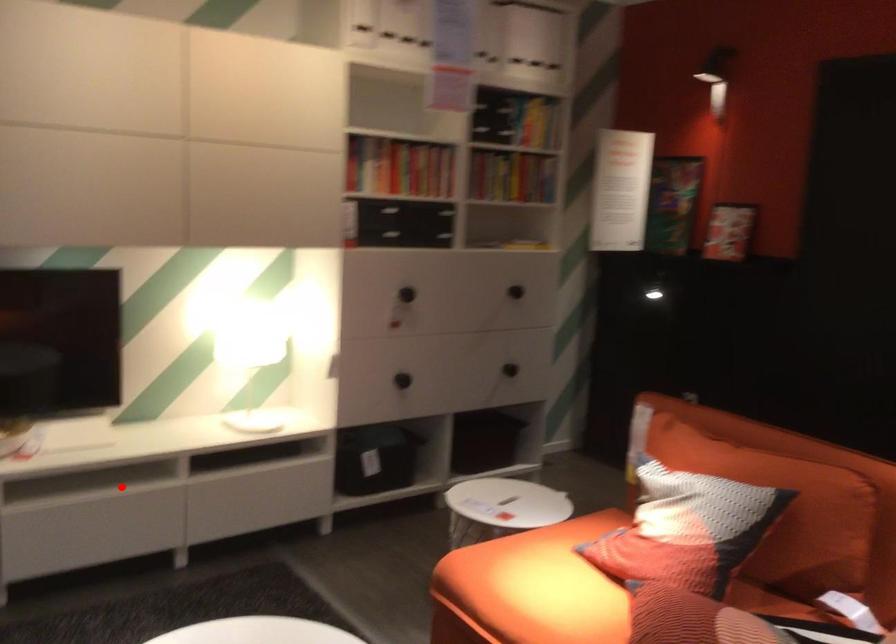
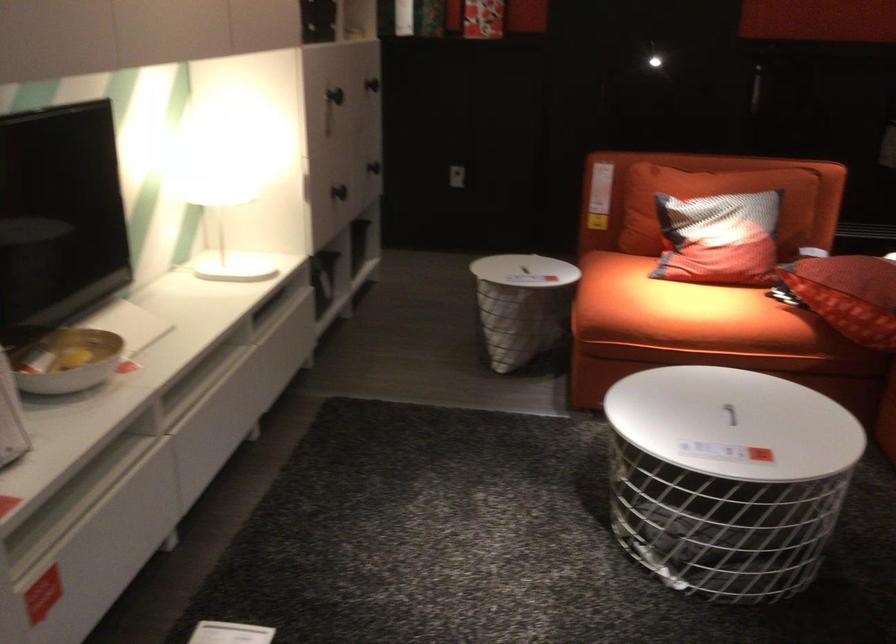
Where in the second image is the point corresponding to the highlighted location from the first image?

(200, 381)